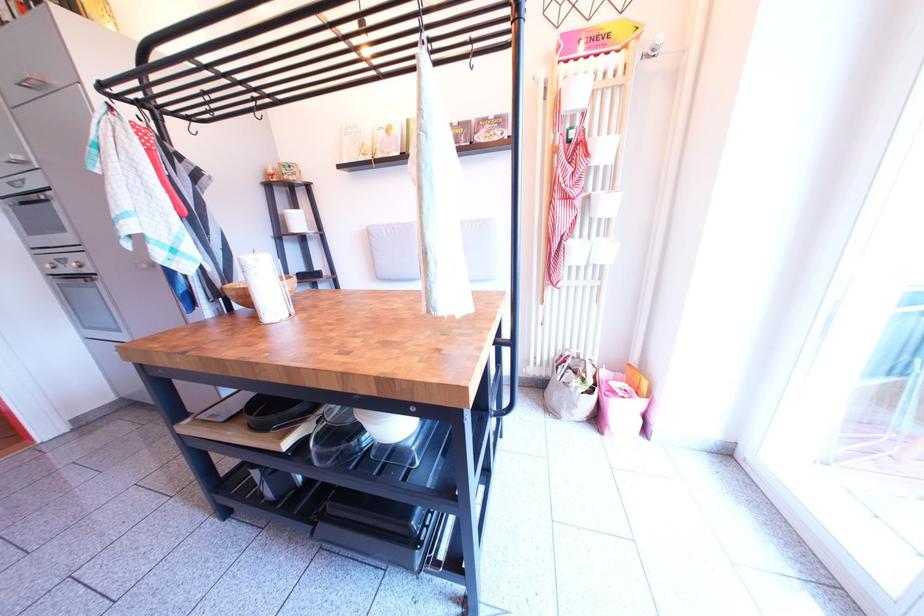
This screenshot has height=616, width=924. Identify the location of wooden bowl. coord(251,291).